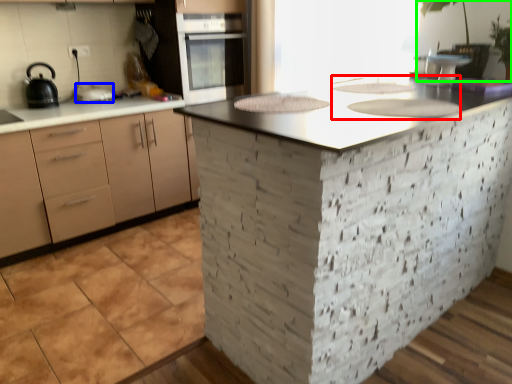
Question: Which object is positioned closest to sink (highlighted by a red box)? Select from kitchen appliance (highlighted by a blue box) and plant (highlighted by a green box).

Choices:
 (A) kitchen appliance
 (B) plant

Answer: (B)